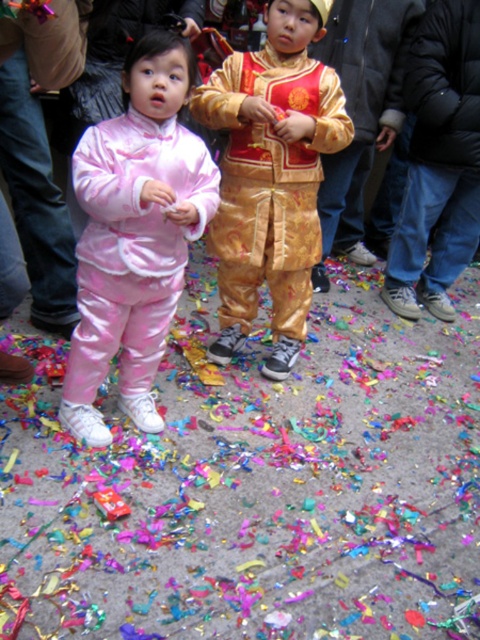
Question: Among these objects, which one is nearest to the camera?

Choices:
 (A) gold shiny outfit at center
 (B) pink satin outfit at center

Answer: (B)

Question: Is the position of pink satin outfit at center less distant than that of gold shiny outfit at center?

Choices:
 (A) no
 (B) yes

Answer: (B)

Question: Does pink satin outfit at center have a greater width compared to gold shiny outfit at center?

Choices:
 (A) yes
 (B) no

Answer: (B)

Question: Is pink satin outfit at center to the left of gold shiny outfit at center from the viewer's perspective?

Choices:
 (A) no
 (B) yes

Answer: (B)

Question: Which of the following is the farthest from the observer?

Choices:
 (A) gold shiny outfit at center
 (B) pink satin outfit at center

Answer: (A)

Question: Which of the following is the farthest from the observer?

Choices:
 (A) (128, 125)
 (B) (266, 275)

Answer: (B)